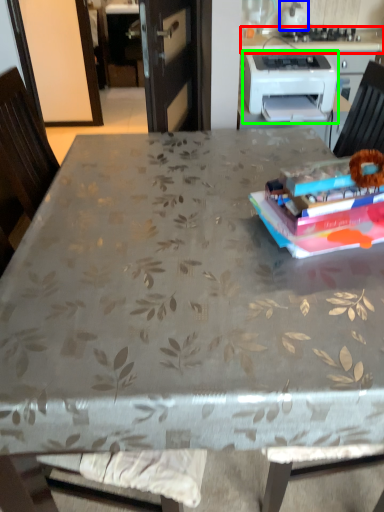
Question: Based on their relative distances, which object is nearer to counter top (highlighted by a red box)? Choose from kitchen appliance (highlighted by a blue box) and printer (highlighted by a green box).

Choices:
 (A) kitchen appliance
 (B) printer

Answer: (A)